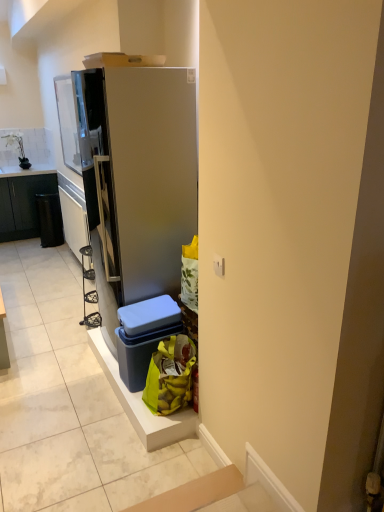
Describe the element at coordinates (73, 215) in the screenshot. I see `metallic silver shelf at left` at that location.

Locate an element on the screen. metallic silver shelf at left is located at coordinates (73, 215).

The height and width of the screenshot is (512, 384). Describe the element at coordinates (139, 170) in the screenshot. I see `satin silver refrigerator at center` at that location.

At what (x,y) coordinates should I click in order to perform the action: click on blue plastic storage box at lower center. Please return your answer as a coordinate pair (x, y). This screenshot has width=384, height=512. Looking at the image, I should click on (144, 336).

Could you tell me if black plastic recycling bin at left is turned towards black matte trash can at left?

No, black plastic recycling bin at left does not turn towards black matte trash can at left.

From the image's perspective, which one is positioned higher, black plastic recycling bin at left or black matte trash can at left?

From the image's view, black matte trash can at left is above.

Who is bigger, black plastic recycling bin at left or black matte trash can at left?

black matte trash can at left.

Are black plastic recycling bin at left and black matte trash can at left far apart?

black plastic recycling bin at left is actually quite close to black matte trash can at left.

Is black matte trash can at left oriented away from blue plastic storage box at lower center?

No.

Is point (11, 240) behind point (159, 339)?

Yes, it is.

Is black matte trash can at left spatially inside blue plastic storage box at lower center, or outside of it?

Answer: black matte trash can at left is located beyond the bounds of blue plastic storage box at lower center.

Considering the sizes of black matte trash can at left and blue plastic storage box at lower center in the image, is black matte trash can at left taller or shorter than blue plastic storage box at lower center?

In the image, black matte trash can at left appears to be taller than blue plastic storage box at lower center.

Which object is positioned more to the right, black plastic recycling bin at left or yellow plastic bag at lower right?

Positioned to the right is yellow plastic bag at lower right.

How many degrees apart are the facing directions of black plastic recycling bin at left and yellow plastic bag at lower right?

They differ by 0.932 degrees in their facing directions.

Is black plastic recycling bin at left looking in the opposite direction of yellow plastic bag at lower right?

That's not correct — black plastic recycling bin at left is not looking away from yellow plastic bag at lower right.

Which is less distant, (43,243) or (147,378)?

Point (147,378)

Does point (30, 222) come closer to viewer compared to point (50, 220)?

That is False.

In terms of width, does black matte trash can at left look wider or thinner when compared to black plastic recycling bin at left?

Considering their sizes, black matte trash can at left looks broader than black plastic recycling bin at left.

Locate an element on the screen. The height and width of the screenshot is (512, 384). cabinetry positioned vertically above the black plastic recycling bin at left (from a real-world perspective) is located at coordinates (23, 204).

Is blue plastic storage box at lower center positioned with its back to yellow plastic bag at lower right?

No, blue plastic storage box at lower center's orientation is not away from yellow plastic bag at lower right.

Is blue plastic storage box at lower center spatially inside yellow plastic bag at lower right, or outside of it?

blue plastic storage box at lower center is spatially situated outside yellow plastic bag at lower right.

At what (x,y) coordinates should I click in order to perform the action: click on storage box that is above the yellow plastic bag at lower right (from the image's perspective). Please return your answer as a coordinate pair (x, y). Looking at the image, I should click on (144, 336).

Consider the image. Does blue plastic storage box at lower center have a lesser width compared to yellow plastic bag at lower right?

In fact, blue plastic storage box at lower center might be wider than yellow plastic bag at lower right.

Between point (185, 340) and point (195, 210), which one is positioned behind?

The point (195, 210) is more distant.

Considering the sizes of yellow plastic bag at lower right and satin silver refrigerator at center in the image, is yellow plastic bag at lower right wider or thinner than satin silver refrigerator at center?

yellow plastic bag at lower right is thinner than satin silver refrigerator at center.

From the image's perspective, which object appears higher, yellow plastic bag at lower right or satin silver refrigerator at center?

From the image's view, satin silver refrigerator at center is above.

Does black plastic recycling bin at left have a lesser height compared to metallic silver shelf at left?

Yes, black plastic recycling bin at left is shorter than metallic silver shelf at left.

Between point (59, 211) and point (85, 218), which one is positioned behind?

The point (59, 211) is farther.

From the image's perspective, is black plastic recycling bin at left beneath metallic silver shelf at left?

Actually, black plastic recycling bin at left appears above metallic silver shelf at left in the image.

Does black plastic recycling bin at left have a larger size compared to metallic silver shelf at left?

Actually, black plastic recycling bin at left might be smaller than metallic silver shelf at left.

The image size is (384, 512). There is a black plastic recycling bin at left. In order to click on cabinetry above it (from a real-world perspective) in this screenshot , I will do `click(23, 204)`.

The image size is (384, 512). In order to click on cabinetry that is behind the blue plastic storage box at lower center in this screenshot , I will do `click(23, 204)`.

Considering their positions, is black plastic recycling bin at left positioned further to satin silver refrigerator at center than metallic silver shelf at left?

Based on the image, black plastic recycling bin at left appears to be further to satin silver refrigerator at center.

Looking at the image, which one is located closer to blue plastic storage box at lower center, black matte trash can at left or yellow plastic bag at lower right?

yellow plastic bag at lower right is positioned closer to the anchor blue plastic storage box at lower center.

From the image, which object appears to be farther from black matte trash can at left, blue plastic storage box at lower center or yellow plastic bag at lower right?

yellow plastic bag at lower right is further to black matte trash can at left.

Which object lies nearer to the anchor point satin silver refrigerator at center, black matte trash can at left or blue plastic storage box at lower center?

blue plastic storage box at lower center is closer to satin silver refrigerator at center.

From the image, which object appears to be farther from yellow plastic bag at lower right, black matte trash can at left or black plastic recycling bin at left?

black matte trash can at left lies further to yellow plastic bag at lower right than the other object.

Looking at the image, which one is located further to blue plastic storage box at lower center, satin silver refrigerator at center or metallic silver shelf at left?

Based on the image, metallic silver shelf at left appears to be further to blue plastic storage box at lower center.

Considering their positions, is satin silver refrigerator at center positioned closer to blue plastic storage box at lower center than black plastic recycling bin at left?

satin silver refrigerator at center is closer to blue plastic storage box at lower center.

When comparing their distances from blue plastic storage box at lower center, does metallic silver shelf at left or black matte trash can at left seem closer?

metallic silver shelf at left lies closer to blue plastic storage box at lower center than the other object.

Find the location of a particular element. The image size is (384, 512). recycling bin located between yellow plastic bag at lower right and black matte trash can at left in the depth direction is located at coordinates (49, 219).

Locate an element on the screen. The image size is (384, 512). recycling bin between metallic silver shelf at left and black matte trash can at left in the front-back direction is located at coordinates (49, 219).

Locate an element on the screen. This screenshot has width=384, height=512. recycling bin located between blue plastic storage box at lower center and black matte trash can at left in the depth direction is located at coordinates (49, 219).

Locate an element on the screen. The width and height of the screenshot is (384, 512). storage box between yellow plastic bag at lower right and black plastic recycling bin at left in the front-back direction is located at coordinates (144, 336).